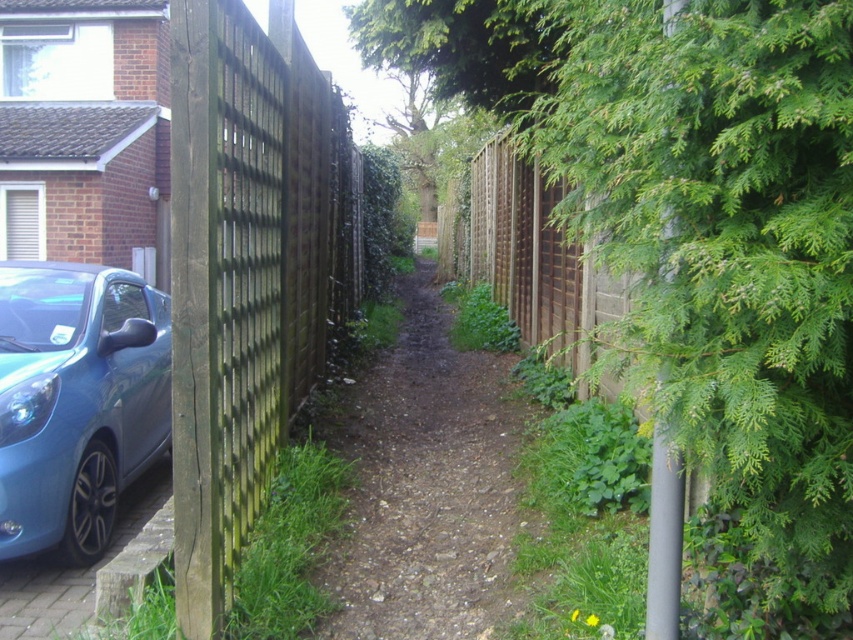
Who is taller, green weathered wood fence at left or dirt/gravel path at center?

green weathered wood fence at left is taller.

Does green weathered wood fence at left have a larger size compared to dirt/gravel path at center?

Incorrect, green weathered wood fence at left is not larger than dirt/gravel path at center.

Is point (209, 570) closer to viewer compared to point (399, 349)?

Yes, point (209, 570) is in front of point (399, 349).

You are a GUI agent. You are given a task and a screenshot of the screen. Output one action in this format:
    pyautogui.click(x=<x>, y=<y>)
    Task: Click on the green weathered wood fence at left
    The height and width of the screenshot is (640, 853).
    Given the screenshot: What is the action you would take?
    pos(241,275)

Which is above, green leafy tree at center or matte blue car at lower left?

green leafy tree at center is higher up.

Describe the element at coordinates (695, 225) in the screenshot. I see `green leafy tree at center` at that location.

Locate an element on the screen. The width and height of the screenshot is (853, 640). green leafy tree at center is located at coordinates (695, 225).

Who is positioned more to the left, green leafy tree at center or metallic blue car at lower left?

Positioned to the left is metallic blue car at lower left.

You are a GUI agent. You are given a task and a screenshot of the screen. Output one action in this format:
    pyautogui.click(x=<x>, y=<y>)
    Task: Click on the green leafy tree at center
    Image resolution: width=853 pixels, height=640 pixels.
    Given the screenshot: What is the action you would take?
    pyautogui.click(x=695, y=225)